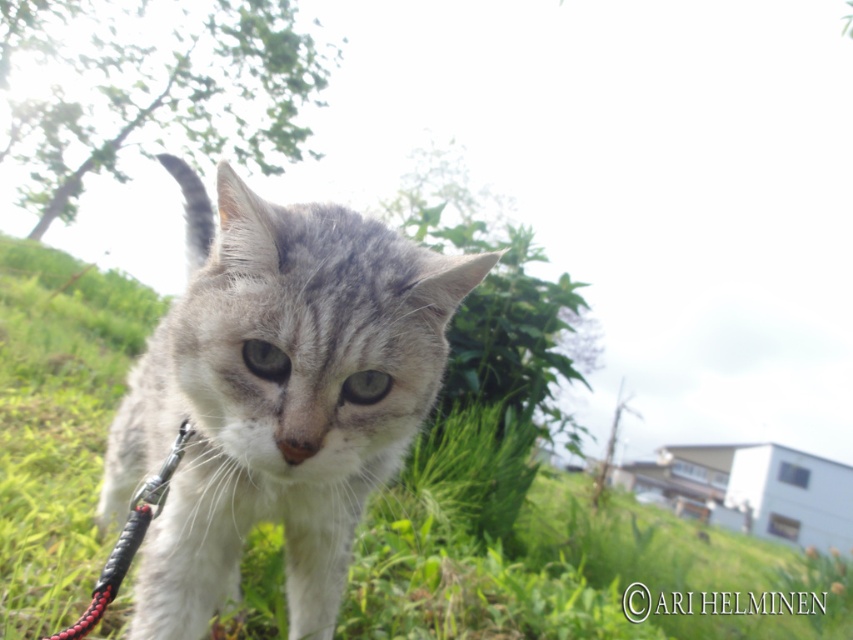
Question: Does green grassy at center have a lesser width compared to gray fur cat at center?

Choices:
 (A) no
 (B) yes

Answer: (B)

Question: Which of the following is the closest to the observer?

Choices:
 (A) green grassy at center
 (B) gray fur cat at center

Answer: (B)

Question: Which point appears closest to the camera in this image?

Choices:
 (A) (236, 196)
 (B) (74, 308)

Answer: (A)

Question: Among these points, which one is nearest to the camera?

Choices:
 (A) (276, 339)
 (B) (6, 525)

Answer: (A)

Question: Can you confirm if green grassy at center is positioned below gray fur cat at center?

Choices:
 (A) no
 (B) yes

Answer: (B)

Question: Is green grassy at center thinner than gray fur cat at center?

Choices:
 (A) yes
 (B) no

Answer: (A)